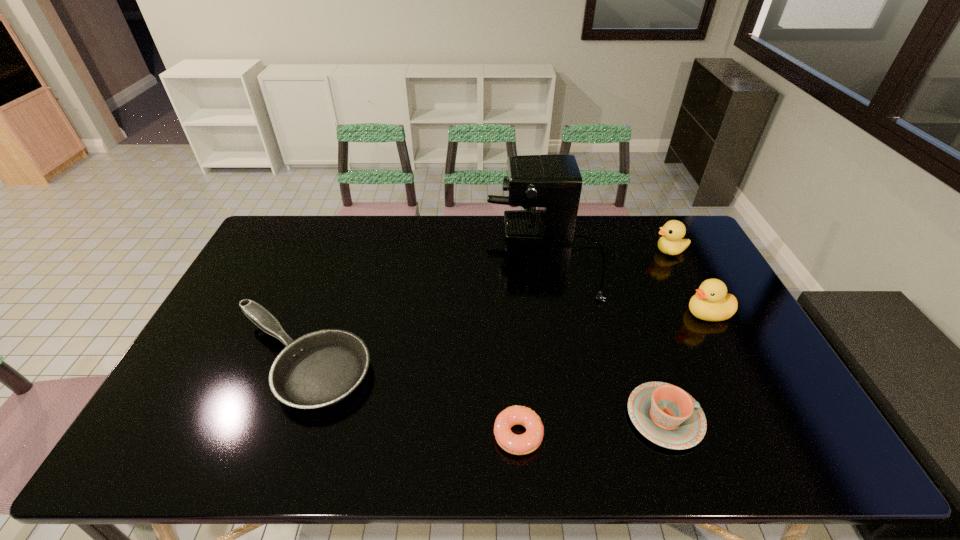
Image resolution: width=960 pixels, height=540 pixels. I want to click on vacant area situated 0.200m at the beak of the nearer duck, so click(619, 313).

Where is `vacant space located 0.360m at the beak of the nearer duck`? The image size is (960, 540). vacant space located 0.360m at the beak of the nearer duck is located at coordinates (566, 313).

Where is `vacant region located 0.060m on the face of the farther duck`? The height and width of the screenshot is (540, 960). vacant region located 0.060m on the face of the farther duck is located at coordinates (636, 251).

Where is `vacant space located 0.150m on the face of the farther duck`? The image size is (960, 540). vacant space located 0.150m on the face of the farther duck is located at coordinates (611, 251).

Find the location of `free space located 0.350m on the face of the farther duck`. free space located 0.350m on the face of the farther duck is located at coordinates (554, 251).

Locate an element on the screen. Image resolution: width=960 pixels, height=540 pixels. vacant space located on the right of the leftmost object is located at coordinates (411, 362).

Locate an element on the screen. vacant space located on the handle side of the chinaware is located at coordinates (771, 417).

You are a GUI agent. You are given a task and a screenshot of the screen. Output one action in this format:
    pyautogui.click(x=<x>, y=<y>)
    Task: Click on the free space located on the left of the shortest object
    
    Given the screenshot: What is the action you would take?
    coord(439,435)

Find the location of a particular element. coffee maker that is at the far edge is located at coordinates (552, 182).

The image size is (960, 540). I want to click on duck present at the far edge, so click(x=671, y=243).